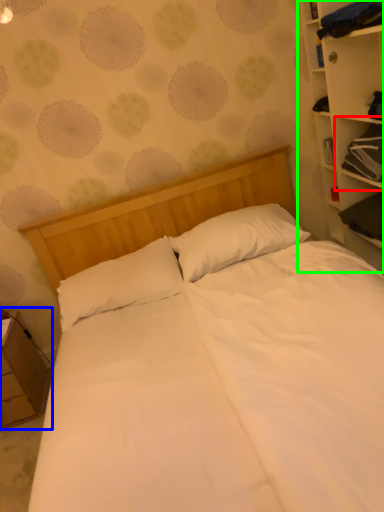
Question: Which object is positioned closest to cabinet (highlighted by a red box)? Select from nightstand (highlighted by a blue box) and bookcase (highlighted by a green box).

Choices:
 (A) nightstand
 (B) bookcase

Answer: (B)